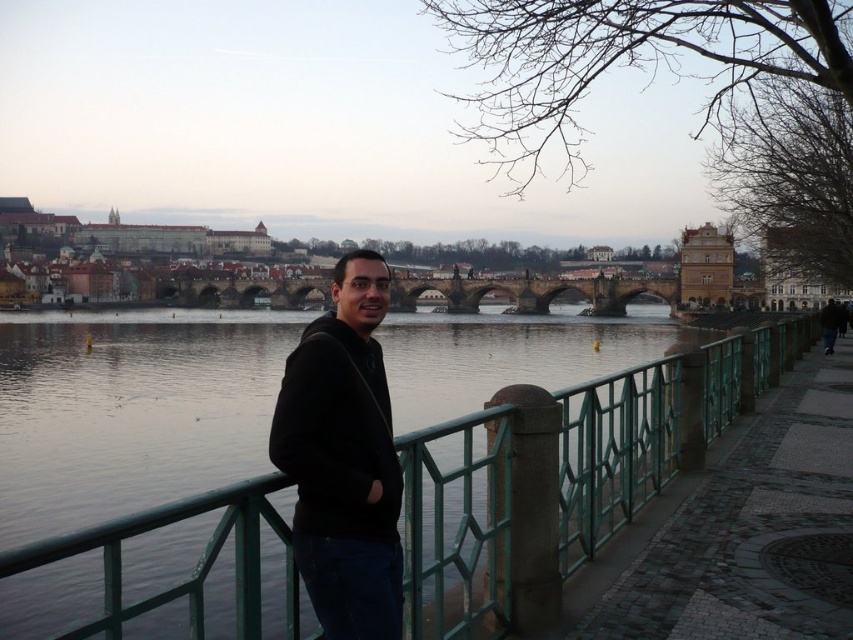
Based on the photo, you are a photographer trying to capture a photo of the stone arch bridge at center and the brown leather jacket at lower right. Which object is positioned higher in the image?

The stone arch bridge at center is located above the brown leather jacket at lower right, so it is positioned higher in the image.

You are a photographer trying to capture both the black matte hoodie at center and the brown leather jacket at lower right in a single frame. Based on their sizes in the image, which object should you focus on first to ensure both are in the frame?

The black matte hoodie at center occupies less space than the brown leather jacket at lower right, so you should focus on the brown leather jacket at lower right first to ensure both are in the frame since it takes up more space and might require adjusting the framing to accommodate its size.